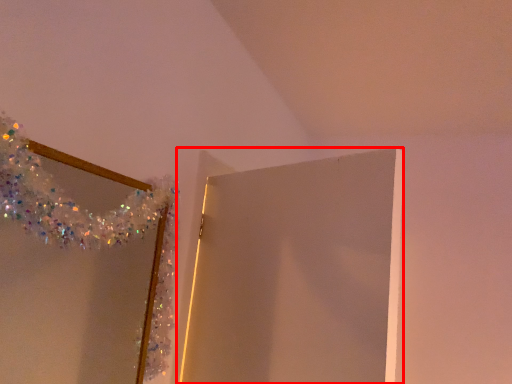
Question: From the image's perspective, where is door (annotated by the red box) located in relation to mirror in the image?

Choices:
 (A) below
 (B) above

Answer: (A)